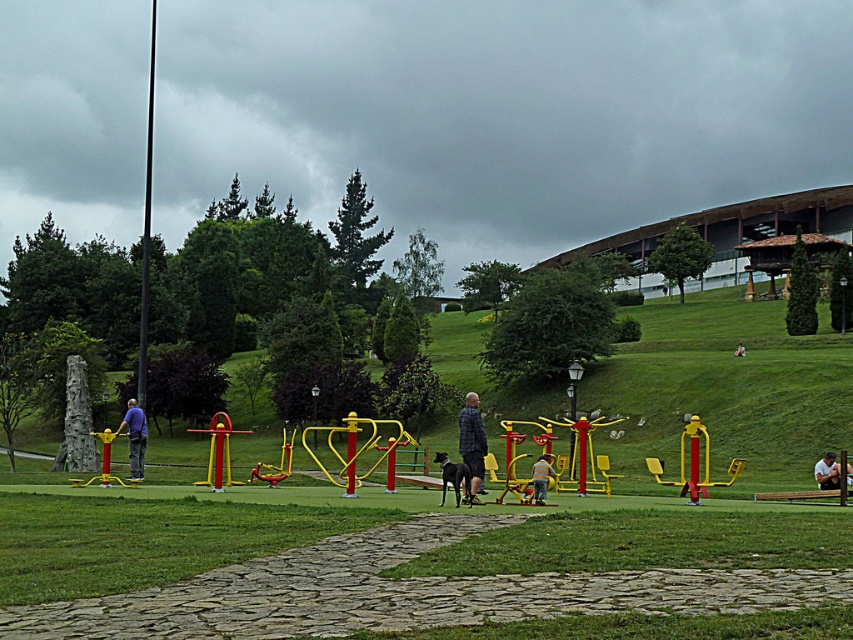
Can you confirm if matte blue shirt at center is smaller than matte yellow exercise machine at center?

No, matte blue shirt at center is not smaller than matte yellow exercise machine at center.

Can you confirm if matte blue shirt at center is thinner than matte yellow exercise machine at center?

In fact, matte blue shirt at center might be wider than matte yellow exercise machine at center.

The image size is (853, 640). Find the location of `matte blue shirt at center`. matte blue shirt at center is located at coordinates (134, 436).

Identify the location of matte blue shirt at center. This screenshot has width=853, height=640. click(x=134, y=436).

Can you confirm if plaid fabric jacket at center is shorter than white cotton shirt at center?

Incorrect, plaid fabric jacket at center's height does not fall short of white cotton shirt at center's.

Is point (473, 433) positioned before point (740, 344)?

Yes.

At what (x,y) coordinates should I click in order to perform the action: click on plaid fabric jacket at center. Please return your answer as a coordinate pair (x, y). This screenshot has height=640, width=853. Looking at the image, I should click on (473, 440).

Who is more distant from viewer, (544, 481) or (735, 348)?

The point (735, 348) is behind.

Is point (550, 467) positioned after point (738, 355)?

That is False.

I want to click on matte yellow exercise machine at center, so click(x=541, y=477).